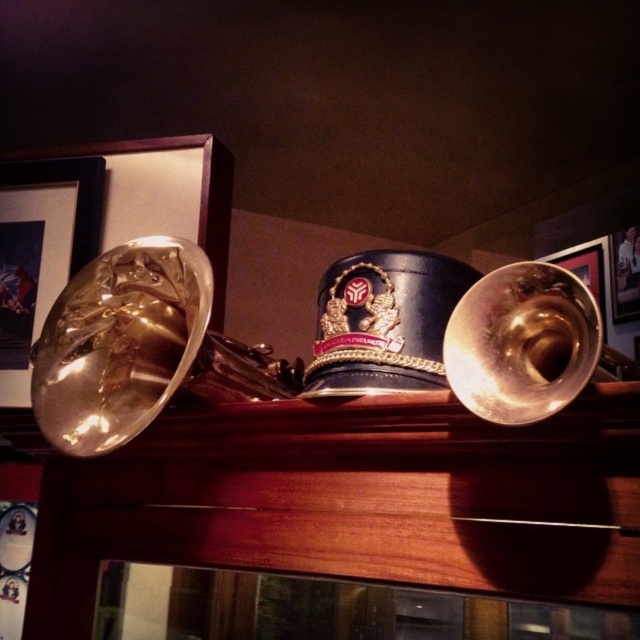
You are an interior designer arranging items on a shelf. You have the metallic gold bell at left and the metallic gold picture frame at upper right. Based on their positions, which item is closer to the left edge of the shelf?

The metallic gold bell at left is closer to the left edge of the shelf because it is positioned to the left of the metallic gold picture frame at upper right.

You are a museum curator arranging a display. The metallic gold bell at left needs to be placed at coordinate point 0.392, 0.064. Can you confirm if the current placement aligns with this requirement?

Yes, the metallic gold bell at left is already placed at coordinate point (40, 250) as required.

You are a museum curator arranging a display. You have two trumpets to place on a narrow shelf. The gold polished trumpet at left and the metallic gold trumpet at right. Which trumpet should you choose to fit on the shelf if the shelf can only accommodate the narrower one?

You should choose the metallic gold trumpet at right because the gold polished trumpet at left might be wider than it.